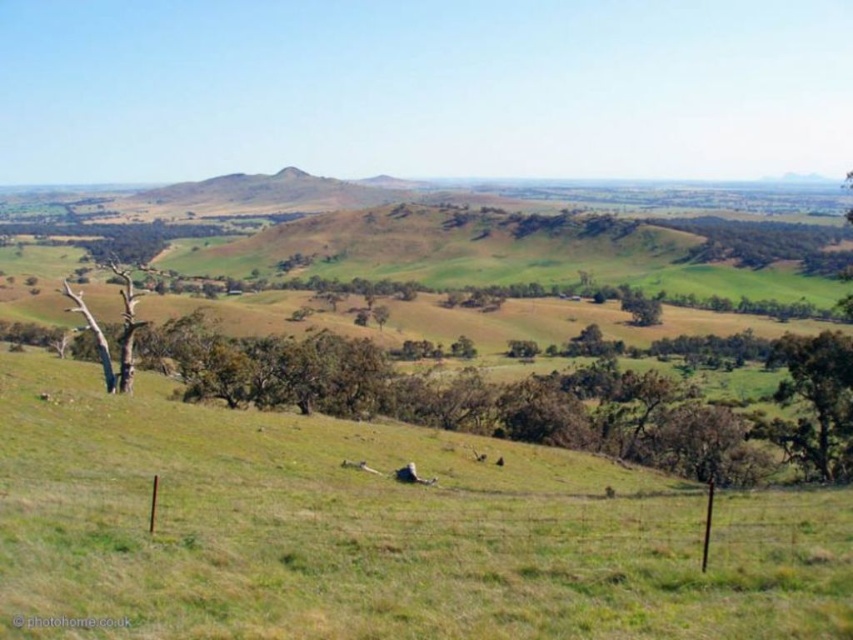
Find the location of a particular element. The width and height of the screenshot is (853, 640). green leafy tree at lower right is located at coordinates (815, 401).

Which is behind, point (793, 378) or point (107, 344)?

The point (793, 378) is more distant.

Find the location of a particular element. green leafy tree at lower right is located at coordinates (815, 401).